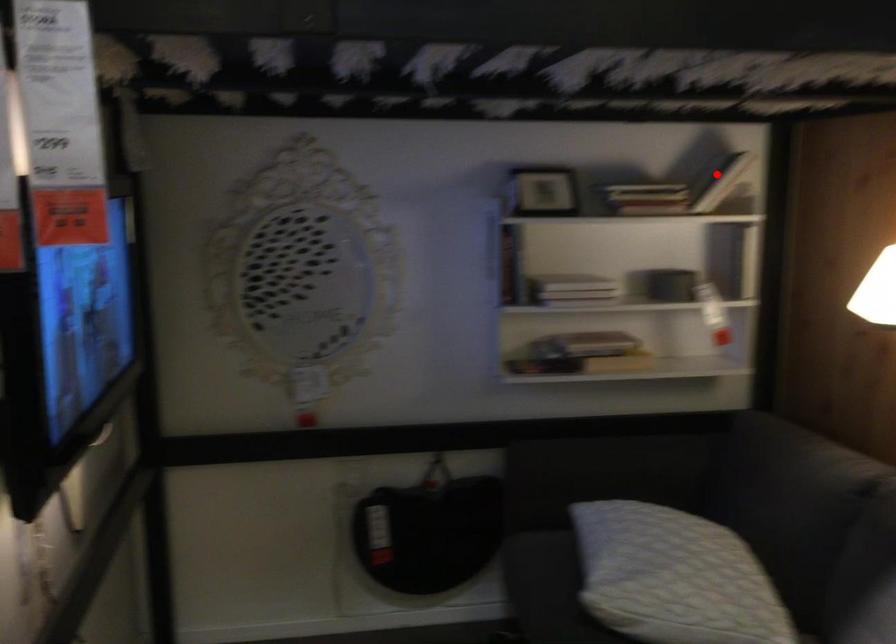
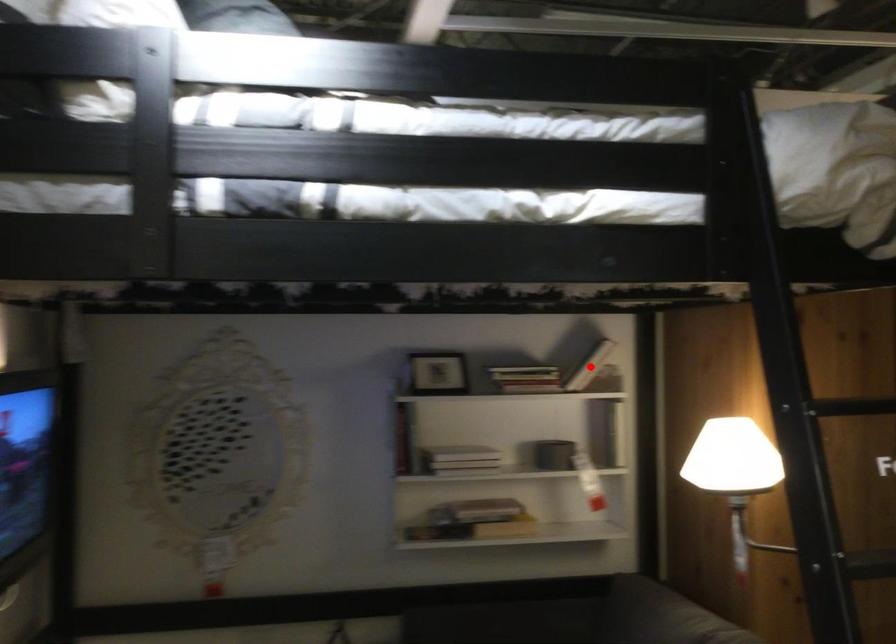
I am providing you with two images of the same scene from different viewpoints. A red point is marked on the first image and another point is marked on the second image. Do the highlighted points in image1 and image2 indicate the same real-world spot?

Yes